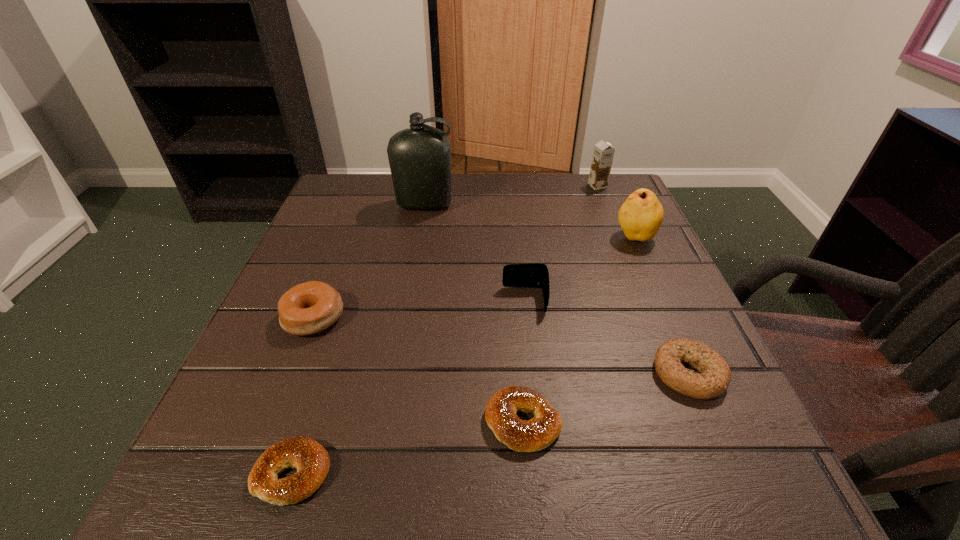
Image resolution: width=960 pixels, height=540 pixels. In order to click on chocolate milk present at the right edge in this screenshot , I will do `click(603, 153)`.

The width and height of the screenshot is (960, 540). I want to click on pear located at the right edge, so click(x=641, y=215).

Locate an element on the screen. The width and height of the screenshot is (960, 540). bagel situated at the right edge is located at coordinates (715, 376).

I want to click on object that is at the near left corner, so click(x=311, y=460).

Where is `object that is at the far right corner`? The height and width of the screenshot is (540, 960). object that is at the far right corner is located at coordinates (603, 153).

Identify the location of vacant region at the far edge of the desktop. The width and height of the screenshot is (960, 540). (514, 216).

In the image, there is a desktop. At what (x,y) coordinates should I click in order to perform the action: click on free space at the near edge. Please return your answer as a coordinate pair (x, y). The height and width of the screenshot is (540, 960). Looking at the image, I should click on (617, 494).

This screenshot has height=540, width=960. In the image, there is a desktop. What are the coordinates of `vacant space at the left edge` in the screenshot? It's located at (367, 257).

This screenshot has width=960, height=540. I want to click on vacant space at the right edge, so click(x=673, y=296).

Locate an element on the screen. Image resolution: width=960 pixels, height=540 pixels. vacant space at the far left corner of the desktop is located at coordinates (388, 204).